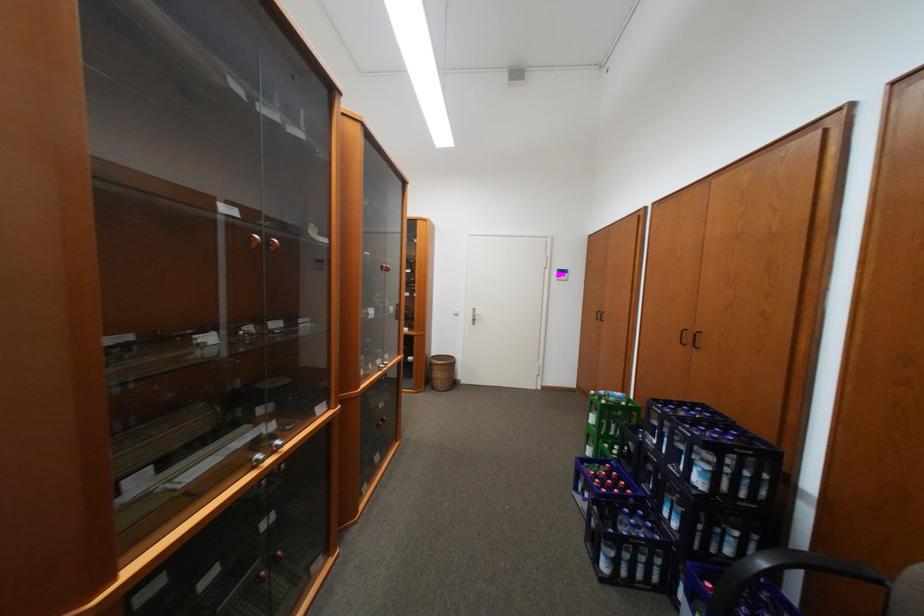
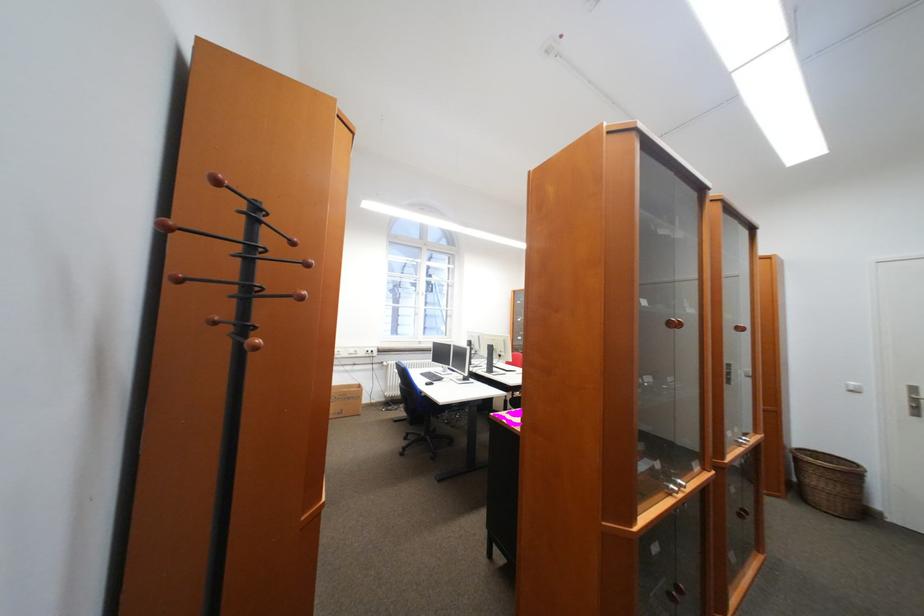
The point at [261,460] is marked in the first image. Where is the corresponding point in the second image?

(676, 487)